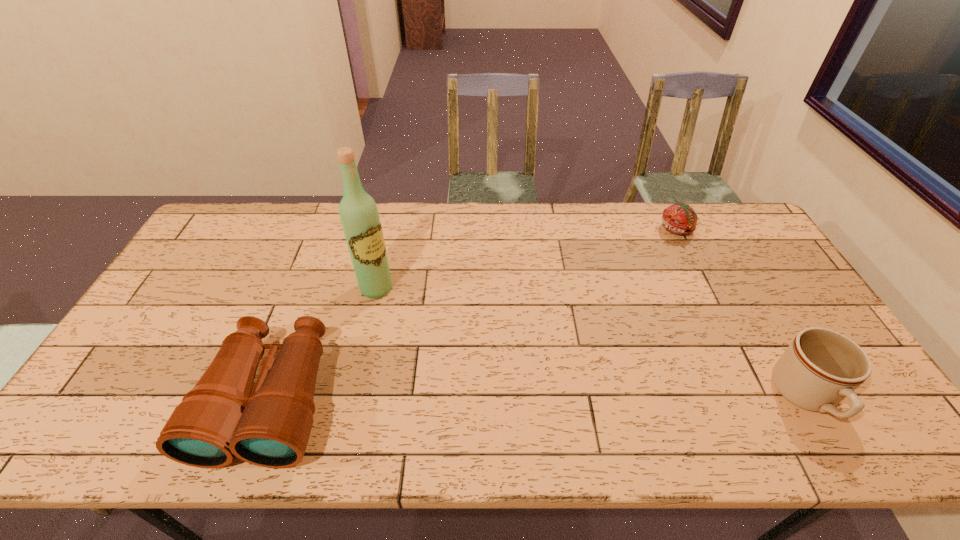
Locate an element on the screen. vacant space on the desktop that is between the binoculars and the mug and is positioned on the front-facing side of the wine bottle is located at coordinates (495, 399).

The image size is (960, 540). Find the location of `vacant space on the desktop that is between the binoculars and the mug and is positioned on the front-facing side of the shortest object`. vacant space on the desktop that is between the binoculars and the mug and is positioned on the front-facing side of the shortest object is located at coordinates (588, 398).